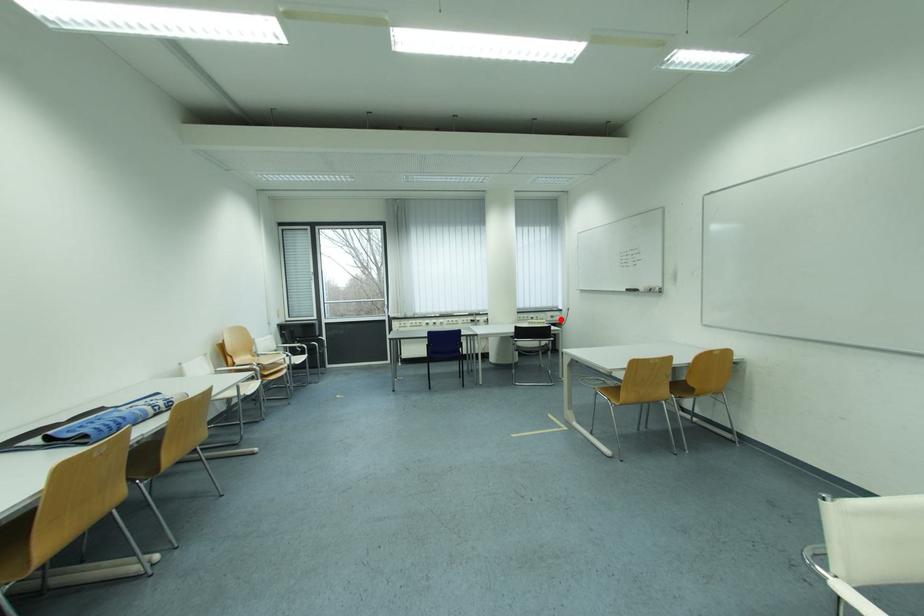
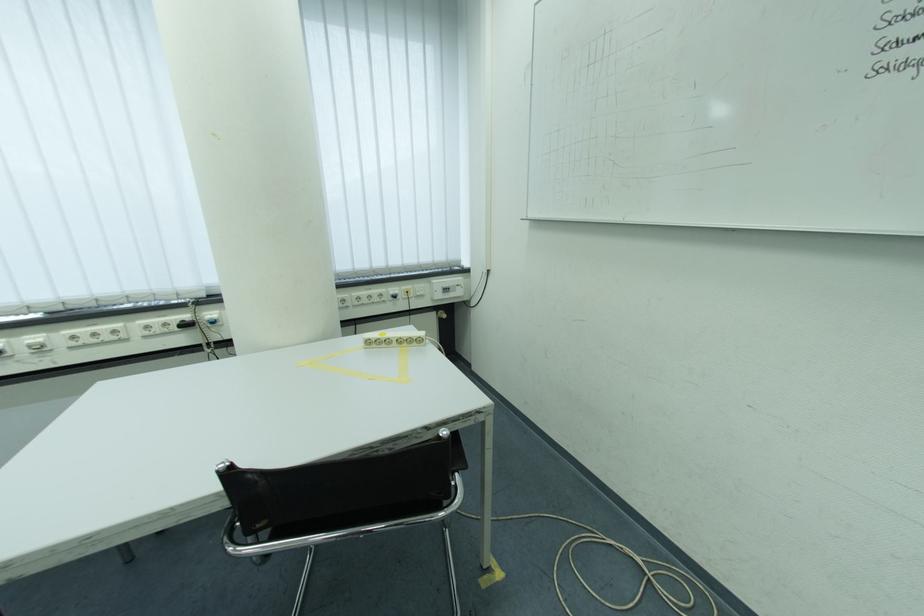
Locate, in the second image, the point that corresponds to the highlighted location in the first image.

(455, 292)